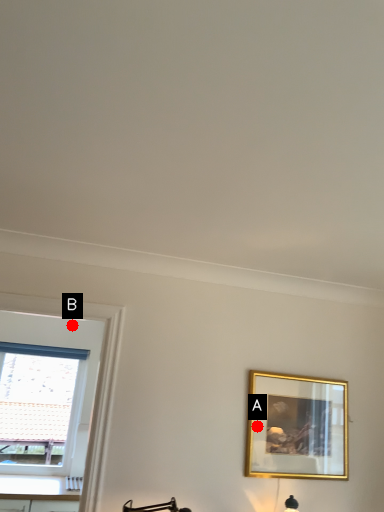
Question: Two points are circled on the image, labeled by A and B beside each circle. Which of the following is the farthest from the observer?

Choices:
 (A) A is further
 (B) B is further

Answer: (B)